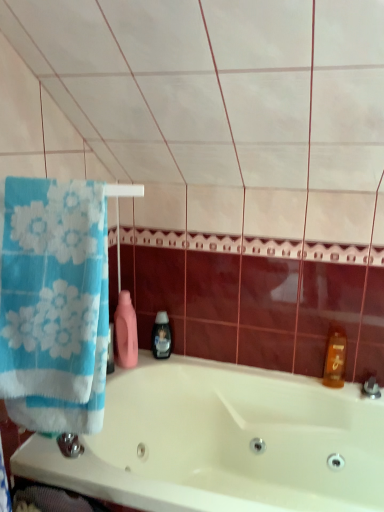
Identify the location of white glossy bathtub at center. Image resolution: width=384 pixels, height=512 pixels. (222, 442).

The height and width of the screenshot is (512, 384). Describe the element at coordinates (53, 303) in the screenshot. I see `blue cotton towel at left` at that location.

Describe the element at coordinates (161, 336) in the screenshot. The width and height of the screenshot is (384, 512). I see `black plastic soap dispenser at center` at that location.

The height and width of the screenshot is (512, 384). Describe the element at coordinates (335, 359) in the screenshot. I see `translucent amber bottle at right` at that location.

I want to click on white glossy bathtub at center, so click(222, 442).

Is translucent amber bottle at right facing towards white glossy bathtub at center?

No, translucent amber bottle at right does not turn towards white glossy bathtub at center.

Is translucent amber bottle at right not close to white glossy bathtub at center?

That's not correct — translucent amber bottle at right is a little close to white glossy bathtub at center.

Considering the relative sizes of translucent amber bottle at right and white glossy bathtub at center in the image provided, is translucent amber bottle at right wider than white glossy bathtub at center?

In fact, translucent amber bottle at right might be narrower than white glossy bathtub at center.

Between translucent amber bottle at right and white glossy bathtub at center, which one appears on the right side from the viewer's perspective?

translucent amber bottle at right is more to the right.

From the image's perspective, between translucent amber bottle at right and blue cotton towel at left, which one is located above?

blue cotton towel at left is shown above in the image.

The width and height of the screenshot is (384, 512). In the image, there is a blue cotton towel at left. Find the location of `cleaning product below it (from the image's perspective)`. cleaning product below it (from the image's perspective) is located at coordinates [x=335, y=359].

Which is correct: translucent amber bottle at right is inside blue cotton towel at left, or outside of it?

translucent amber bottle at right cannot be found inside blue cotton towel at left.

From a real-world perspective, which object stands above the other?

blue cotton towel at left.

How far apart are blue cotton towel at left and translucent amber bottle at right?

blue cotton towel at left and translucent amber bottle at right are 3.49 feet apart.

Can you see blue cotton towel at left touching translucent amber bottle at right?

No, blue cotton towel at left is not beside translucent amber bottle at right.

Based on their sizes in the image, would you say blue cotton towel at left is bigger or smaller than translucent amber bottle at right?

In the image, blue cotton towel at left appears to be larger than translucent amber bottle at right.

From the image's perspective, is blue cotton towel at left above translucent amber bottle at right?

Yes, from the image's perspective, blue cotton towel at left is on top of translucent amber bottle at right.

Who is smaller, blue cotton towel at left or black plastic soap dispenser at center?

black plastic soap dispenser at center is smaller.

Based on the photo, how far apart are blue cotton towel at left and black plastic soap dispenser at center?

31.97 inches.

What's the angular difference between blue cotton towel at left and black plastic soap dispenser at center's facing directions?

109 degrees separate the facing orientations of blue cotton towel at left and black plastic soap dispenser at center.

Considering the relative positions of blue cotton towel at left and black plastic soap dispenser at center in the image provided, is blue cotton towel at left to the left or to the right of black plastic soap dispenser at center?

From the image, it's evident that blue cotton towel at left is to the left of black plastic soap dispenser at center.

Considering the positions of objects black plastic soap dispenser at center and blue cotton towel at left in the image provided, who is more to the left, black plastic soap dispenser at center or blue cotton towel at left?

blue cotton towel at left is more to the left.

From a real-world perspective, is black plastic soap dispenser at center physically above blue cotton towel at left?

Actually, black plastic soap dispenser at center is physically below blue cotton towel at left in the real world.

Is black plastic soap dispenser at center facing towards blue cotton towel at left?

Yes, black plastic soap dispenser at center faces towards blue cotton towel at left.

The height and width of the screenshot is (512, 384). I want to click on towel located in front of the black plastic soap dispenser at center, so click(53, 303).

From a real-world perspective, is white glossy bathtub at center beneath translucent amber bottle at right?

Correct, in the physical world, white glossy bathtub at center is lower than translucent amber bottle at right.

Considering the relative sizes of white glossy bathtub at center and translucent amber bottle at right in the image provided, is white glossy bathtub at center shorter than translucent amber bottle at right?

No.

Which object is closer to the camera, white glossy bathtub at center or translucent amber bottle at right?

Positioned in front is white glossy bathtub at center.

Considering the sizes of white glossy bathtub at center and blue cotton towel at left in the image, is white glossy bathtub at center bigger or smaller than blue cotton towel at left?

white glossy bathtub at center is bigger than blue cotton towel at left.

Which object is closer to the camera, white glossy bathtub at center or blue cotton towel at left?

blue cotton towel at left is closer to the camera.

From a real-world perspective, between white glossy bathtub at center and blue cotton towel at left, who is vertically lower?

white glossy bathtub at center is physically lower.

At what (x,y) coordinates should I click in order to perform the action: click on cleaning product on the right of white glossy bathtub at center. Please return your answer as a coordinate pair (x, y). Looking at the image, I should click on (335, 359).

Find the location of a particular element. towel in front of the translucent amber bottle at right is located at coordinates (53, 303).

Estimate the real-world distances between objects in this image. Which object is further from translucent amber bottle at right, white glossy bathtub at center or blue cotton towel at left?

blue cotton towel at left lies further to translucent amber bottle at right than the other object.

Considering their positions, is blue cotton towel at left positioned further to translucent amber bottle at right than white glossy bathtub at center?

blue cotton towel at left.

When comparing their distances from translucent amber bottle at right, does blue cotton towel at left or black plastic soap dispenser at center seem further?

blue cotton towel at left.

Considering their positions, is blue cotton towel at left positioned further to white glossy bathtub at center than translucent amber bottle at right?

blue cotton towel at left is further to white glossy bathtub at center.

From the image, which object appears to be farther from black plastic soap dispenser at center, white glossy bathtub at center or translucent amber bottle at right?

translucent amber bottle at right.

Based on their spatial positions, is white glossy bathtub at center or black plastic soap dispenser at center closer to blue cotton towel at left?

The object closer to blue cotton towel at left is white glossy bathtub at center.

Considering their positions, is white glossy bathtub at center positioned closer to translucent amber bottle at right than black plastic soap dispenser at center?

white glossy bathtub at center is positioned closer to the anchor translucent amber bottle at right.

Based on their spatial positions, is white glossy bathtub at center or translucent amber bottle at right further from blue cotton towel at left?

translucent amber bottle at right lies further to blue cotton towel at left than the other object.

Locate an element on the screen. Image resolution: width=384 pixels, height=512 pixels. cleaning product between white glossy bathtub at center and black plastic soap dispenser at center along the z-axis is located at coordinates (335, 359).

The image size is (384, 512). What are the coordinates of `cleaning product between blue cotton towel at left and black plastic soap dispenser at center in the front-back direction` in the screenshot? It's located at (335, 359).

What are the coordinates of `bathtub between blue cotton towel at left and black plastic soap dispenser at center along the z-axis` in the screenshot? It's located at (222, 442).

Locate an element on the screen. The image size is (384, 512). bathtub between blue cotton towel at left and translucent amber bottle at right is located at coordinates (222, 442).